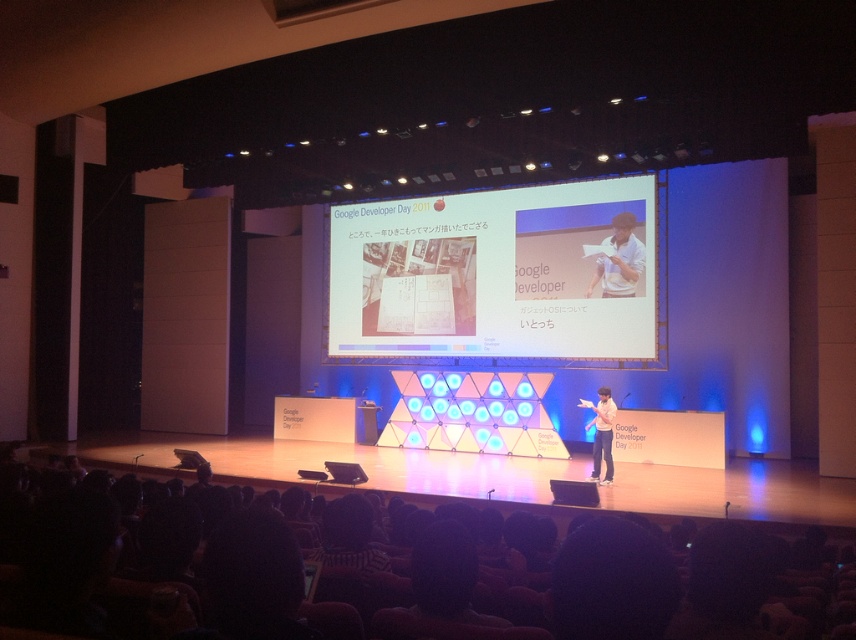
Based on the photo, you are a photographer at the Google Developer Day event. You need to capture a photo of both the black casual wear at center and the white shirt at center so that both are fully visible. Given that your camera can only focus on subjects within a 1.2 meter height range, will you be able to frame both individuals in the same shot without cropping either?

The black casual wear at center has a lesser height compared to white shirt at center. Since the height difference is not specified, but the camera can focus within a 1.2 meter range, it depends on their actual heights. However, assuming typical adult heights, the difference is likely within the 1.2 meter range, so yes, both can be framed without cropping.

You are a photographer at the Google Developer Day event and need to capture a clear photo of the presenter. The presenter is wearing both a black casual wear at center and a white shirt at center. Which clothing item should you focus on to ensure the text on the screen is visible in the background?

The black casual wear at center is positioned over the white shirt at center, so focusing on the black casual wear at center will allow the text on the screen to be visible in the background.

You are an attendee at the Google Developer Day event. You want to take a photo of the presentation screen behind the speaker wearing the white cotton shirt at center. Is the matte black laptop at center blocking your view of the screen?

The matte black laptop at center is behind the white cotton shirt at center, so it is not blocking the view of the presentation screen. You can take the photo without any obstruction.